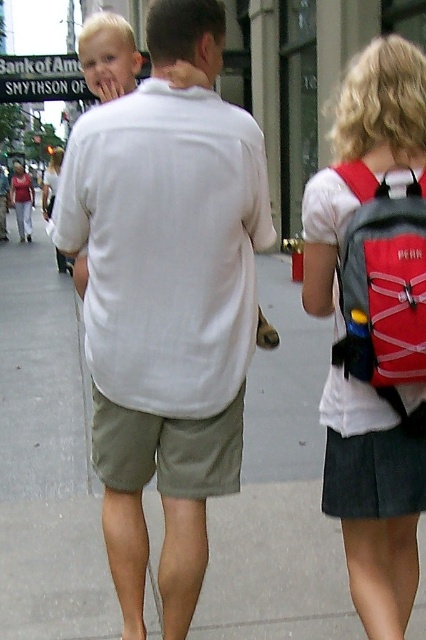
What are the coordinates of the khaki cotton shorts at center?

The khaki cotton shorts at center are located at coordinates point (167, 449).

You are a photographer trying to capture the scene. You notice the white cotton shirt at center and the red fabric backpack at upper right. Which object should you focus on if you want to capture the larger one?

The white cotton shirt at center is larger in size than the red fabric backpack at upper right, so you should focus on the white cotton shirt at center to capture the larger one.

You are a photographer trying to capture a candid shot of the white cotton shirt at center and the red fabric backpack at right. Which object should you zoom in on if you want to focus on the larger one?

The white cotton shirt at center is bigger than the red fabric backpack at right, so you should zoom in on the white cotton shirt at center to focus on the larger one.